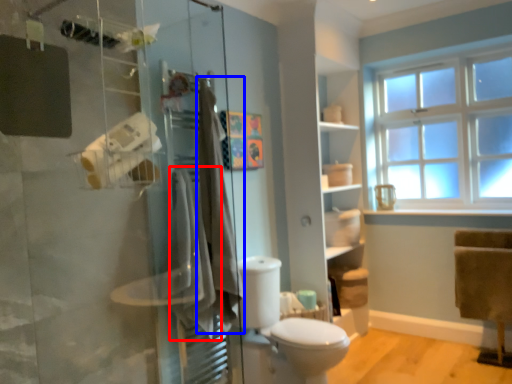
Question: Which object appears farthest to the camera in this image, bath towel (highlighted by a red box) or bath towel (highlighted by a blue box)?

Choices:
 (A) bath towel
 (B) bath towel

Answer: (B)